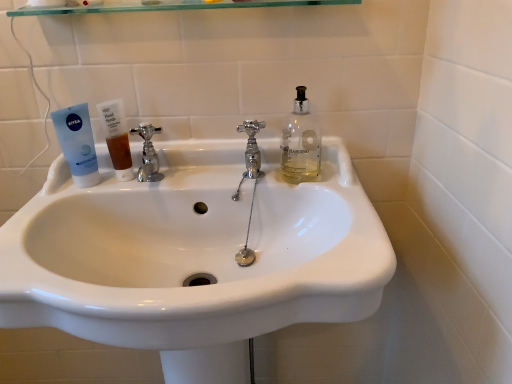
This screenshot has height=384, width=512. Identify the location of blank area beneath transparent glass shelf at upper center (from a real-world perspective). (200, 142).